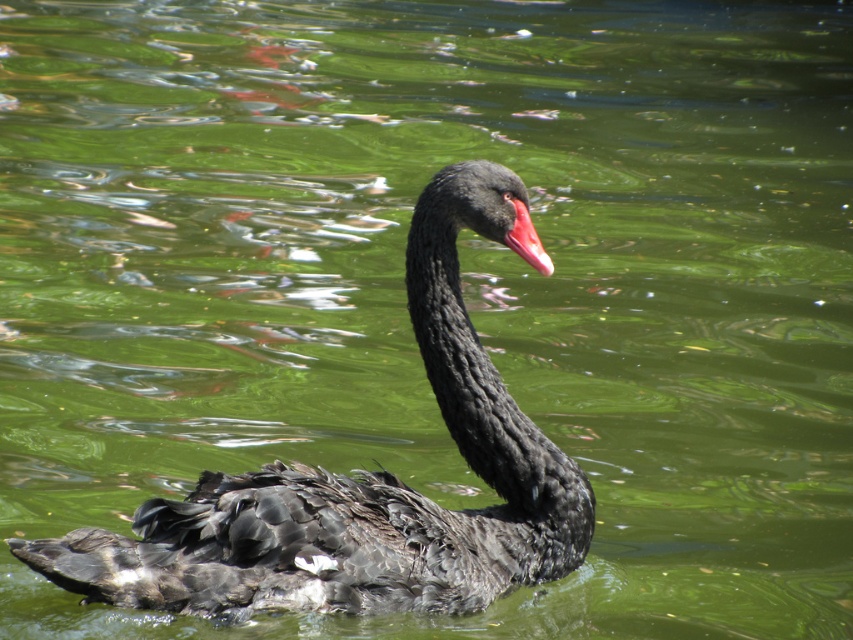
Does shiny black swan at center have a lesser height compared to matte pink beak at center?

No, shiny black swan at center is not shorter than matte pink beak at center.

Consider the image. Who is more distant from viewer, (312, 545) or (531, 232)?

Positioned behind is point (531, 232).

Image resolution: width=853 pixels, height=640 pixels. In order to click on shiny black swan at center in this screenshot , I will do `click(363, 484)`.

Where is `shiny black swan at center`? This screenshot has width=853, height=640. shiny black swan at center is located at coordinates (363, 484).